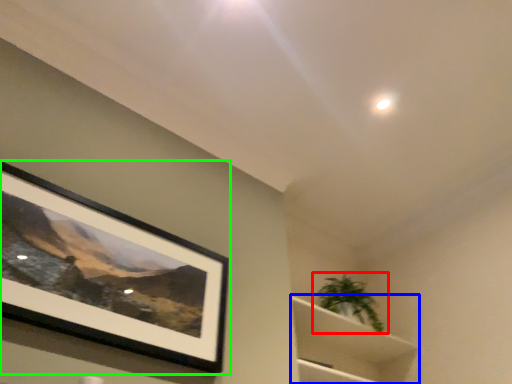
Question: Considering the real-world distances, which object is farthest from houseplant (highlighted by a red box)? cabinet (highlighted by a blue box) or picture frame (highlighted by a green box)?

Choices:
 (A) cabinet
 (B) picture frame

Answer: (B)